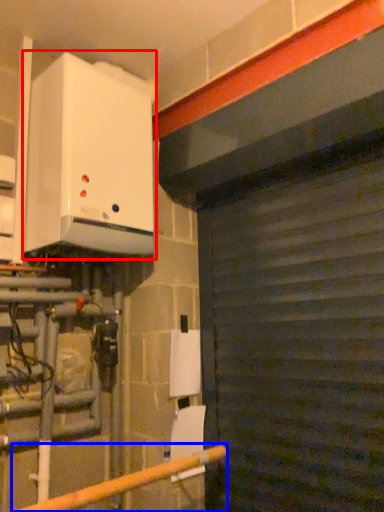
Question: Which point is closer to the camera, home appliance (highlighted by a red box) or rail (highlighted by a blue box)?

Choices:
 (A) home appliance
 (B) rail

Answer: (B)